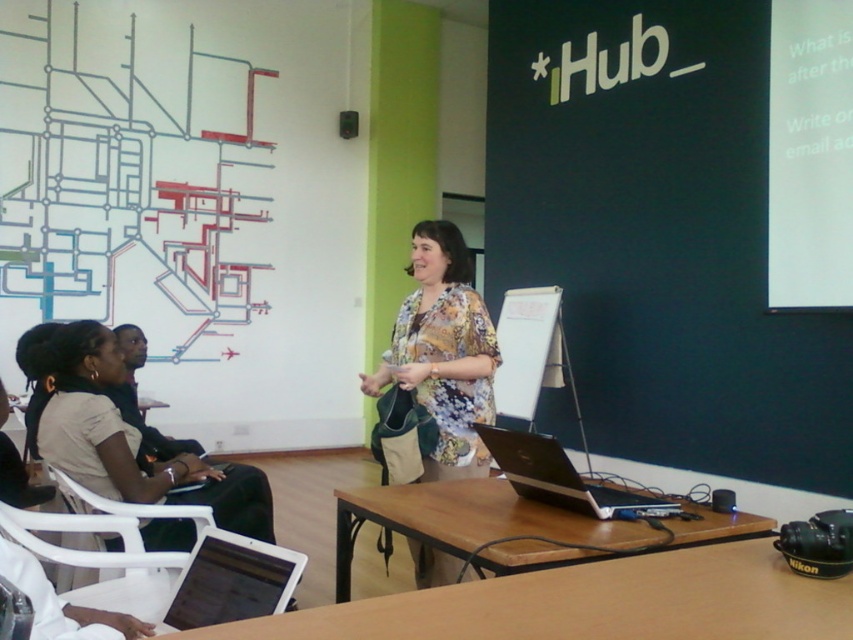
Question: From the image, what is the correct spatial relationship of silver metallic laptop at lower left in relation to silver/black laptop at center?

Choices:
 (A) below
 (B) above

Answer: (A)

Question: Among these points, which one is farthest from the camera?

Choices:
 (A) click(796, 97)
 (B) click(514, 474)
 (C) click(492, 332)
 (D) click(799, 547)

Answer: (A)

Question: Which object is closer to the camera taking this photo?

Choices:
 (A) floral fabric shirt at center
 (B) white plastic chair at lower left
 (C) silver metallic laptop at lower left

Answer: (C)

Question: Is silver/black laptop at center to the right of white plastic chair at lower left from the viewer's perspective?

Choices:
 (A) yes
 (B) no

Answer: (A)

Question: Estimate the real-world distances between objects in this image. Which object is farther from the white matte projection screen at upper right?

Choices:
 (A) white plastic chair at lower left
 (B) green matte projector at lower right

Answer: (A)

Question: Is white matte projection screen at upper right to the left of floral fabric shirt at center from the viewer's perspective?

Choices:
 (A) yes
 (B) no

Answer: (B)